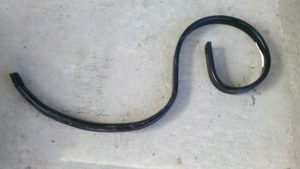
This screenshot has width=300, height=169. Identify the location of light grey flat surface. (222, 120).